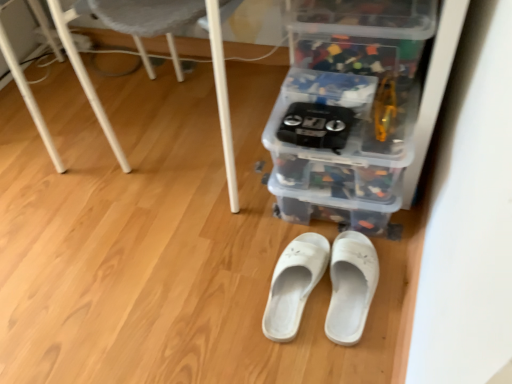
You are a GUI agent. You are given a task and a screenshot of the screen. Output one action in this format:
    pyautogui.click(x=<x>, y=<y>)
    Task: Click on the vacant point to the left of white fabric slipper at center, which is the first footwear from right to left
    
    Given the screenshot: What is the action you would take?
    pyautogui.click(x=246, y=296)